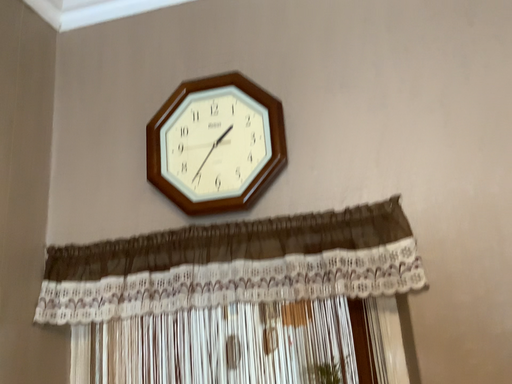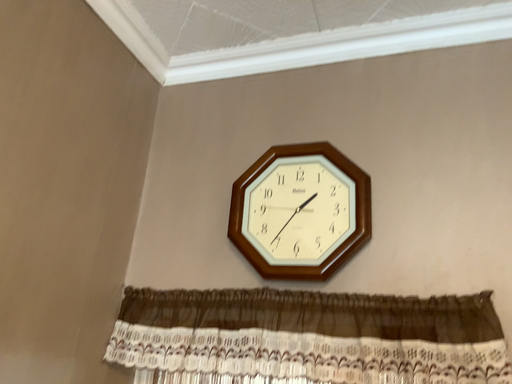
Question: Which way did the camera rotate in the video?

Choices:
 (A) rotated left
 (B) rotated right

Answer: (A)